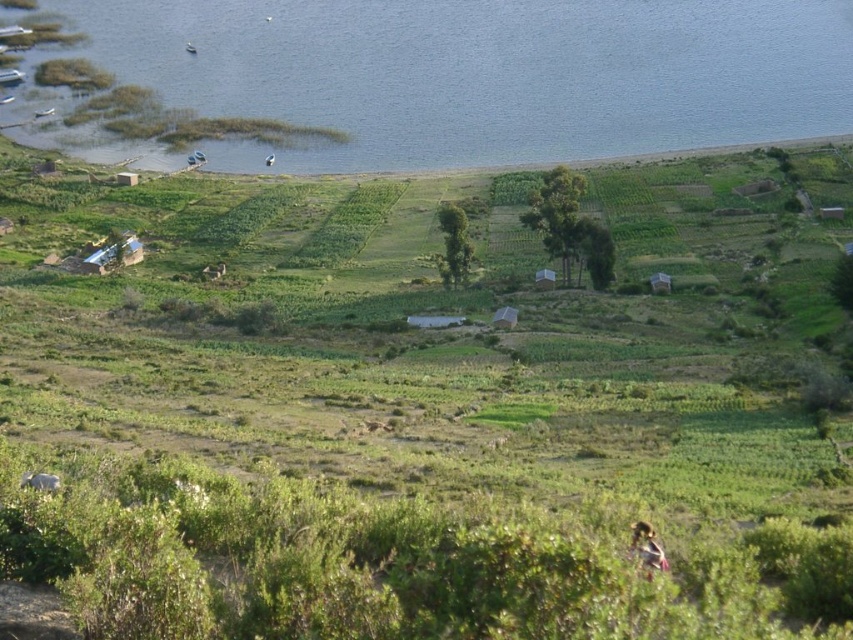
Question: Is blue water at upper left closer to the viewer compared to blurred yellowish-green figure at lower center?

Choices:
 (A) no
 (B) yes

Answer: (A)

Question: Which point is farther to the camera?

Choices:
 (A) blue water at upper left
 (B) blurred yellowish-green figure at lower center

Answer: (A)

Question: Which object is farther from the camera taking this photo?

Choices:
 (A) blurred yellowish-green figure at lower center
 (B) blue water at upper left

Answer: (B)

Question: Can you confirm if blue water at upper left is thinner than blurred yellowish-green figure at lower center?

Choices:
 (A) yes
 (B) no

Answer: (B)

Question: Observing the image, what is the correct spatial positioning of blue water at upper left in reference to blurred yellowish-green figure at lower center?

Choices:
 (A) left
 (B) right

Answer: (A)